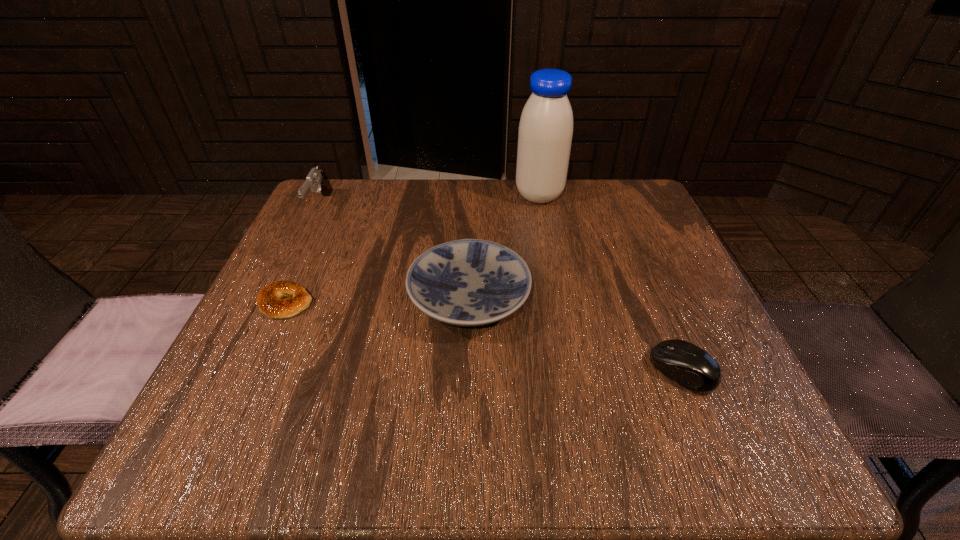
Locate an element on the screen. vacant space located 0.260m on the back of the bagel is located at coordinates (327, 212).

Locate an element on the screen. soya milk at the far edge is located at coordinates (545, 133).

The image size is (960, 540). Identify the location of gun at the far edge. (316, 178).

What are the coordinates of `gun that is at the left edge` in the screenshot? It's located at (316, 178).

Locate an element on the screen. bagel at the left edge is located at coordinates (269, 301).

At what (x,y) coordinates should I click in order to perform the action: click on object that is at the right edge. Please return your answer as a coordinate pair (x, y). Image resolution: width=960 pixels, height=540 pixels. Looking at the image, I should click on (688, 365).

The width and height of the screenshot is (960, 540). Find the location of `object located at the far left corner`. object located at the far left corner is located at coordinates (316, 178).

Identify the location of free space at the far edge. The image size is (960, 540). (506, 210).

Where is `vacant space at the left edge of the desktop`? The image size is (960, 540). vacant space at the left edge of the desktop is located at coordinates (269, 382).

This screenshot has width=960, height=540. Identify the location of vacant space at the right edge. (652, 237).